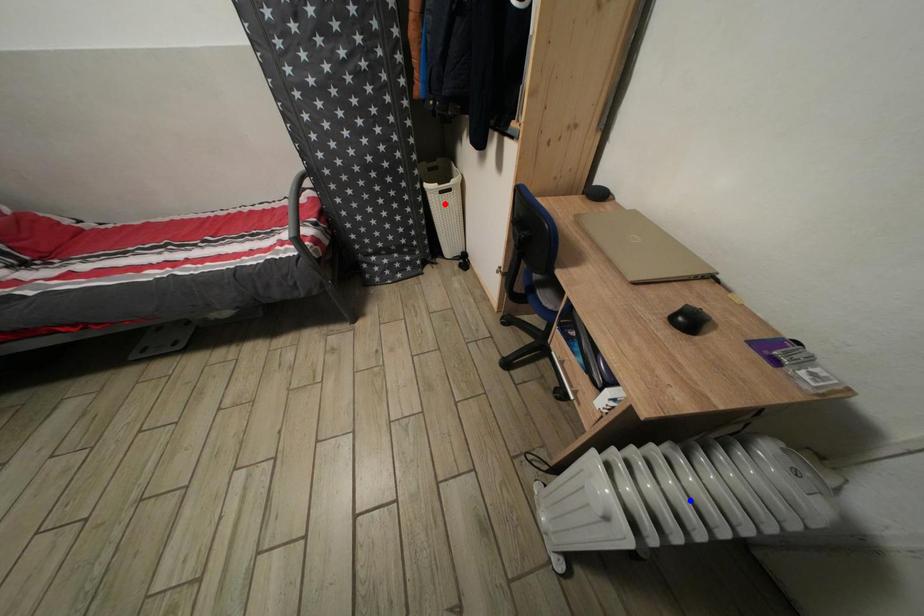
Question: Two points are marked on the image. Which point is closer to the camera?

Choices:
 (A) Blue point is closer.
 (B) Red point is closer.

Answer: (A)